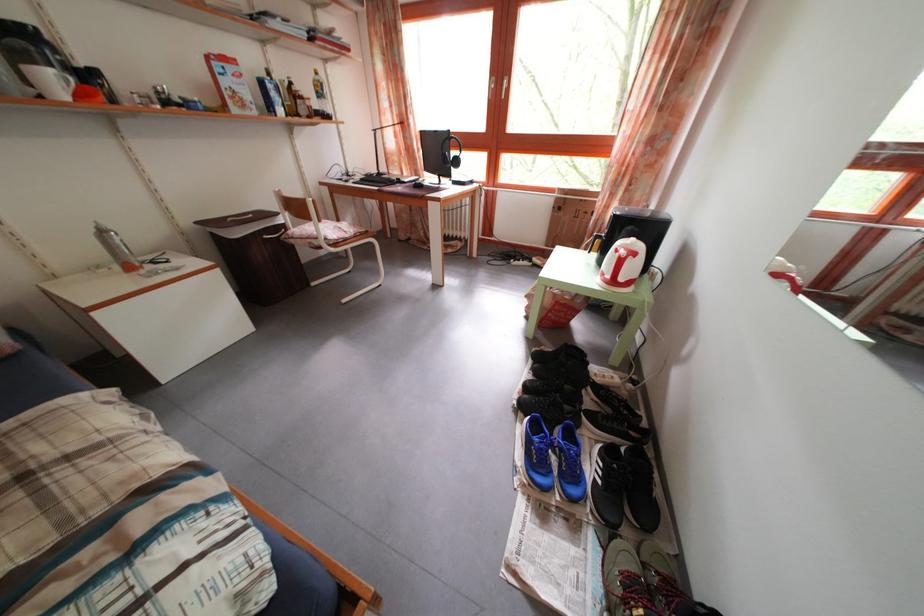
Find where to lift the orange plastic cup. Please return your answer as a coordinate pair (x, y).

(88, 94)